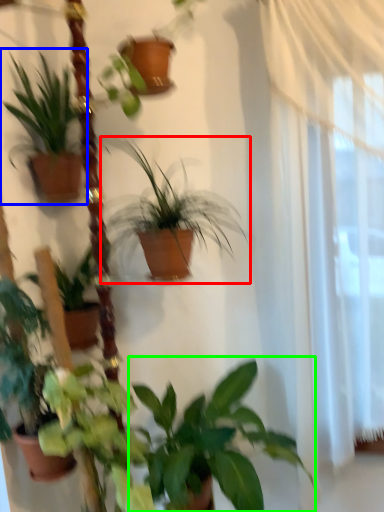
Question: Estimate the real-world distances between objects in this image. Which object is closer to houseplant (highlighted by a red box), houseplant (highlighted by a blue box) or houseplant (highlighted by a green box)?

Choices:
 (A) houseplant
 (B) houseplant

Answer: (A)